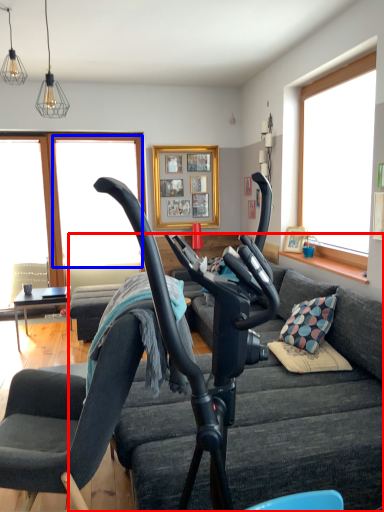
Question: Among these objects, which one is farthest to the camera, studio couch (highlighted by a red box) or window screen (highlighted by a blue box)?

Choices:
 (A) studio couch
 (B) window screen

Answer: (B)